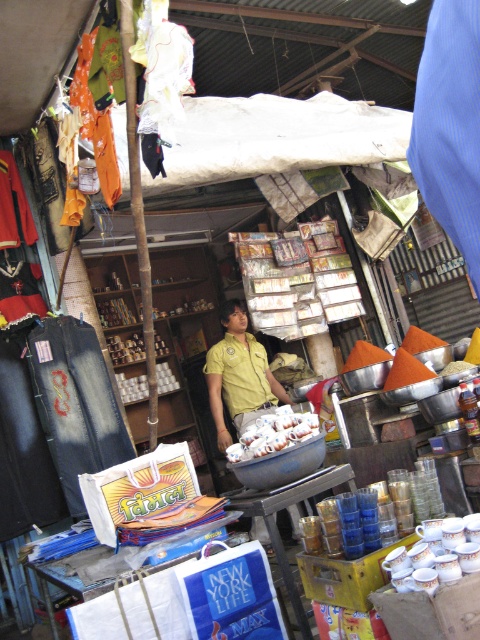
Which is below, yellow uniform at center or white matte eggs at center?

Positioned lower is white matte eggs at center.

Is yellow uniform at center taller than white matte eggs at center?

Yes.

You are a GUI agent. You are given a task and a screenshot of the screen. Output one action in this format:
    pyautogui.click(x=<x>, y=<y>)
    Task: Click on the yellow uniform at center
    This screenshot has height=640, width=480.
    Given the screenshot: What is the action you would take?
    pyautogui.click(x=239, y=372)